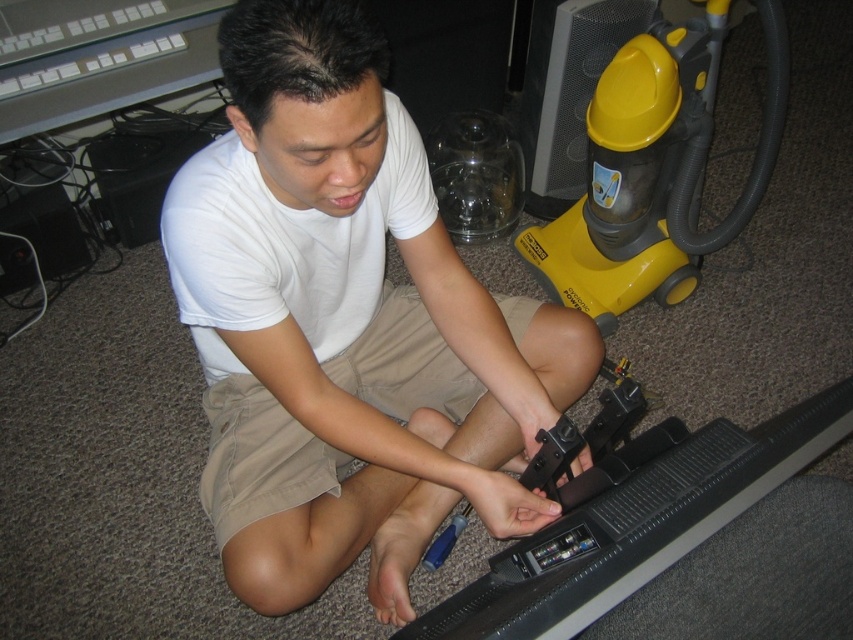
Question: Considering the real-world distances, which object is farthest from the black plastic tv at lower center?

Choices:
 (A) khaki shorts at center
 (B) yellow plastic vacuum cleaner at right

Answer: (B)

Question: Observing the image, what is the correct spatial positioning of black plastic tv at lower center in reference to khaki shorts at center?

Choices:
 (A) below
 (B) above

Answer: (A)

Question: Does yellow plastic vacuum cleaner at right lie behind khaki shorts at center?

Choices:
 (A) no
 (B) yes

Answer: (B)

Question: Based on their relative distances, which object is farther from the black plastic tv at lower center?

Choices:
 (A) yellow plastic vacuum cleaner at right
 (B) white matte shirt at center

Answer: (A)

Question: Does white matte shirt at center have a lesser width compared to khaki shorts at center?

Choices:
 (A) yes
 (B) no

Answer: (B)

Question: Which object is positioned closest to the yellow plastic vacuum cleaner at right?

Choices:
 (A) white matte shirt at center
 (B) khaki shorts at center

Answer: (B)